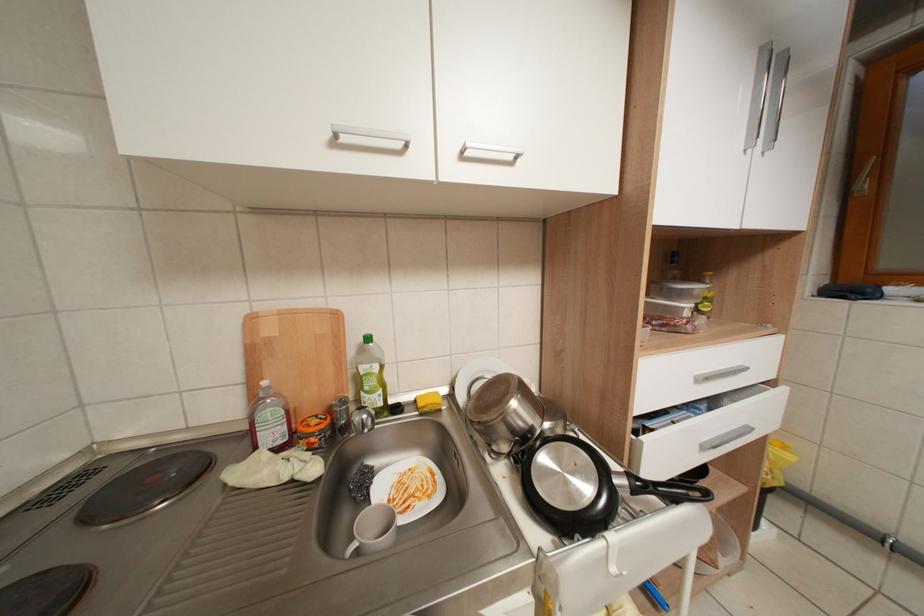
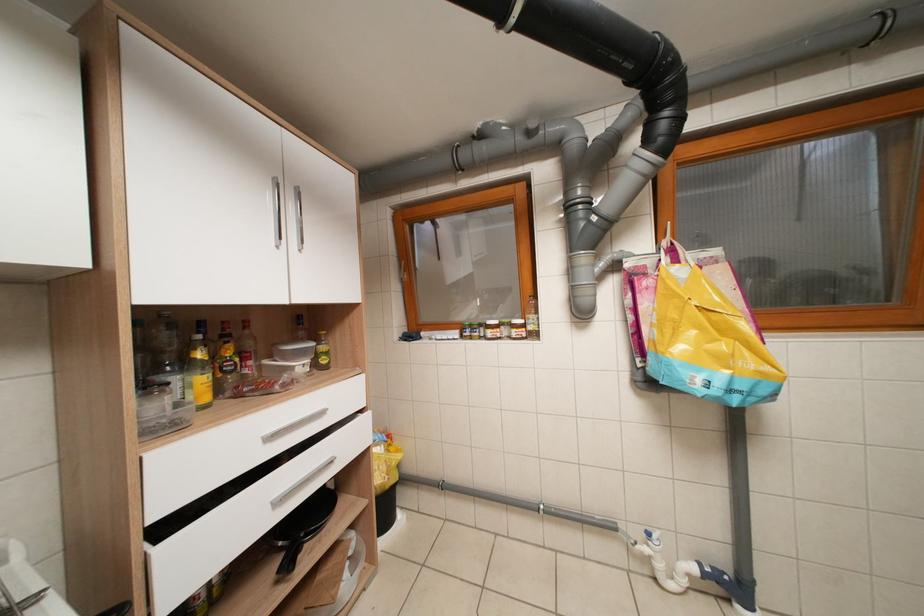
Question: The first image is from the beginning of the video and the second image is from the end. How did the camera likely rotate when shooting the video?

Choices:
 (A) Left
 (B) Right
 (C) Up
 (D) Down

Answer: (B)